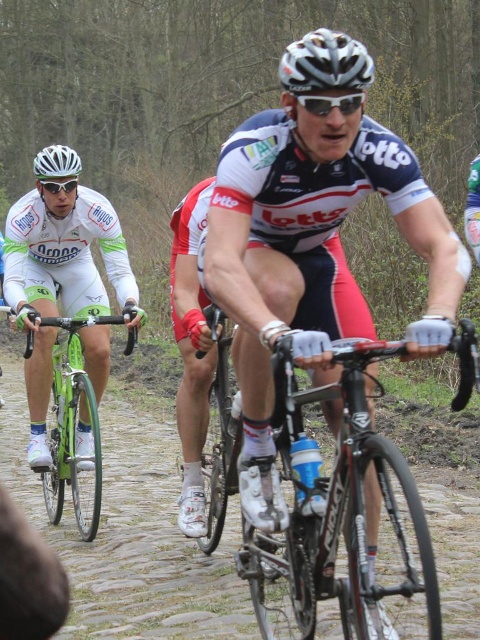
Identify the location of white matte bicycle helmet at center. The width and height of the screenshot is (480, 640). (324, 64).

Is white matte bicycle helmet at center behind white matte bicycle helmet at upper left?

No, white matte bicycle helmet at center is in front of white matte bicycle helmet at upper left.

Describe the element at coordinates (324, 64) in the screenshot. I see `white matte bicycle helmet at center` at that location.

Where is `white matte bicycle helmet at center`? The width and height of the screenshot is (480, 640). white matte bicycle helmet at center is located at coordinates (324, 64).

Which of these two, shiny metallic bicycle at center or white matte helmet at upper left, stands taller?

With more height is shiny metallic bicycle at center.

Is shiny metallic bicycle at center closer to the viewer compared to white matte helmet at upper left?

Yes.

Is point (216, 524) behind point (60, 218)?

No, (216, 524) is in front of (60, 218).

I want to click on shiny metallic bicycle at center, so tap(219, 436).

Does shiny black frame at center come behind white matte helmet at center?

No, it is not.

Can you confirm if shiny black frame at center is positioned above white matte helmet at center?

No.

Identify the location of shiny black frame at center. The height and width of the screenshot is (640, 480). (336, 504).